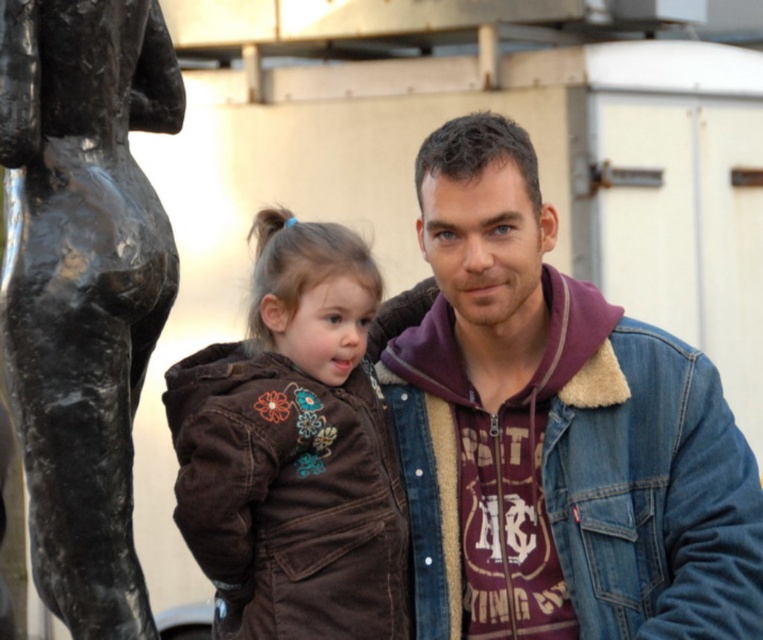
Who is more forward, [557,547] or [314,372]?

Point [314,372]

Who is shorter, denim jacket at right or brown corduroy jacket at center?

Standing shorter between the two is brown corduroy jacket at center.

Describe the element at coordinates (578, 483) in the screenshot. I see `denim jacket at right` at that location.

Where is `denim jacket at right`? Image resolution: width=763 pixels, height=640 pixels. denim jacket at right is located at coordinates (578, 483).

Is denim jacket at right wider than black polished statue at left?

Yes.

Who is more distant from viewer, [757,513] or [72,476]?

Positioned behind is point [757,513].

You are a GUI agent. You are given a task and a screenshot of the screen. Output one action in this format:
    pyautogui.click(x=<x>, y=<y>)
    Task: Click on the denim jacket at right
    The width and height of the screenshot is (763, 640).
    Given the screenshot: What is the action you would take?
    pyautogui.click(x=578, y=483)

Which of these two, black polished statue at left or brown corduroy jacket at center, stands taller?

black polished statue at left is taller.

Is black polished statue at left taller than brown corduroy jacket at center?

Indeed, black polished statue at left has a greater height compared to brown corduroy jacket at center.

Measure the distance between black polished statue at left and camera.

They are 27.69 meters apart.

Identify the location of black polished statue at left. (82, 285).